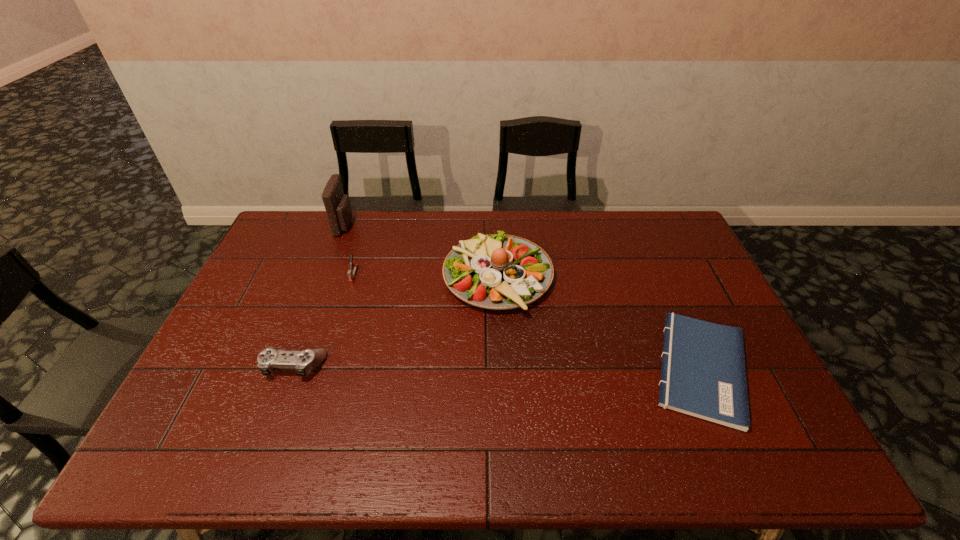
Locate an element on the screen. This screenshot has width=960, height=540. the tallest object is located at coordinates (337, 205).

Find the location of a particular element. Image resolution: width=960 pixels, height=540 pixels. the farthest object is located at coordinates (337, 205).

The height and width of the screenshot is (540, 960). What are the coordinates of `the second object from right to left` in the screenshot? It's located at [494, 271].

Image resolution: width=960 pixels, height=540 pixels. What are the coordinates of `the second tallest object` in the screenshot? It's located at (494, 271).

The height and width of the screenshot is (540, 960). In order to click on stapler in this screenshot , I will do `click(351, 273)`.

Locate an element on the screen. the second shortest object is located at coordinates (304, 361).

Where is `the shortest object`? the shortest object is located at coordinates (703, 374).

You are a GUI agent. You are given a task and a screenshot of the screen. Output one action in this format:
    pyautogui.click(x=<x>, y=<y>)
    Task: Click on the rightmost object
    The height and width of the screenshot is (540, 960).
    Given the screenshot: What is the action you would take?
    pyautogui.click(x=703, y=374)

Locate an element on the screen. The height and width of the screenshot is (540, 960). vacant space located 0.220m with an open flap on the pouch is located at coordinates (412, 226).

This screenshot has height=540, width=960. What are the coordinates of `vacant space positioned 0.290m on the left of the fourth shortest object` in the screenshot? It's located at (353, 277).